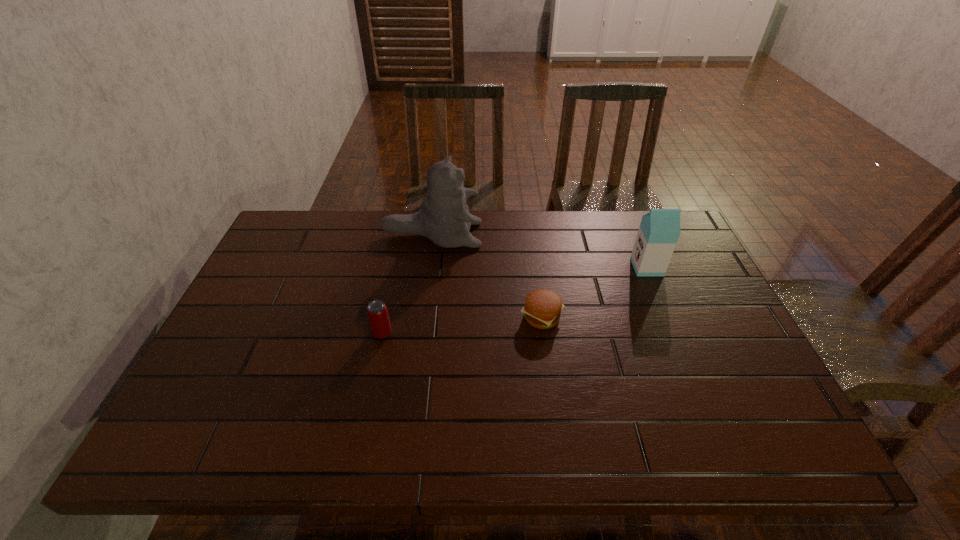
I want to click on the tallest object, so click(444, 218).

Locate an element on the screen. cat is located at coordinates (444, 218).

In order to click on the second tallest object in this screenshot , I will do `click(659, 230)`.

Locate an element on the screen. the third nearest object is located at coordinates (659, 230).

Identify the location of beer can. The width and height of the screenshot is (960, 540). (377, 312).

The width and height of the screenshot is (960, 540). I want to click on hamburger, so click(542, 309).

Image resolution: width=960 pixels, height=540 pixels. In order to click on the third object from left to right in this screenshot , I will do `click(542, 309)`.

Find the location of a particular element. The height and width of the screenshot is (540, 960). vacant space situated on the face of the farthest object is located at coordinates (577, 235).

Locate an element on the screen. vacant space located on the front of the second tallest object is located at coordinates tap(694, 382).

Locate an element on the screen. The height and width of the screenshot is (540, 960). free space located 0.070m on the left of the beer can is located at coordinates (345, 333).